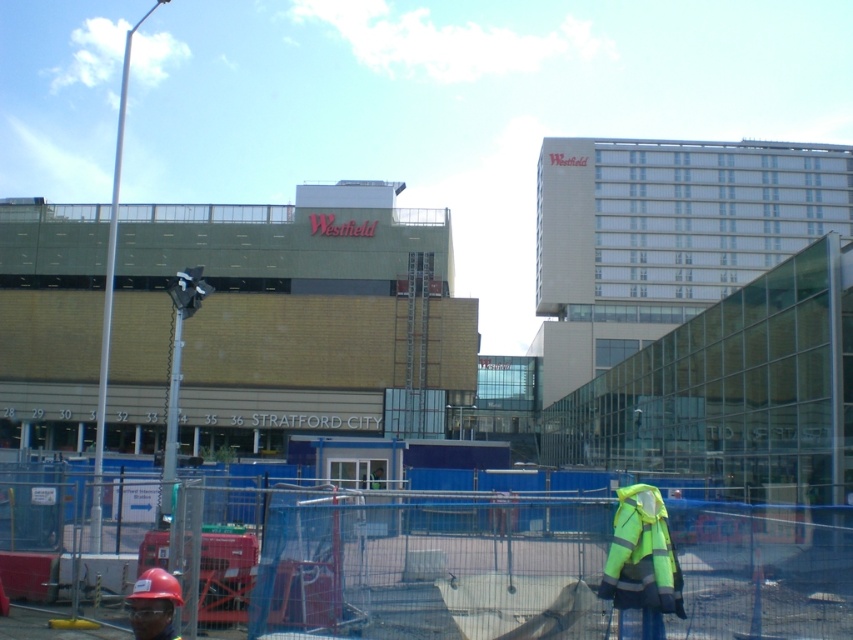
Is blue mesh fence at lower center bigger than neon yellow reflective vest at lower right?

Correct, blue mesh fence at lower center is larger in size than neon yellow reflective vest at lower right.

Who is lower down, blue mesh fence at lower center or neon yellow reflective vest at lower right?

blue mesh fence at lower center is below.

Find the location of a particular element. The width and height of the screenshot is (853, 640). blue mesh fence at lower center is located at coordinates (378, 561).